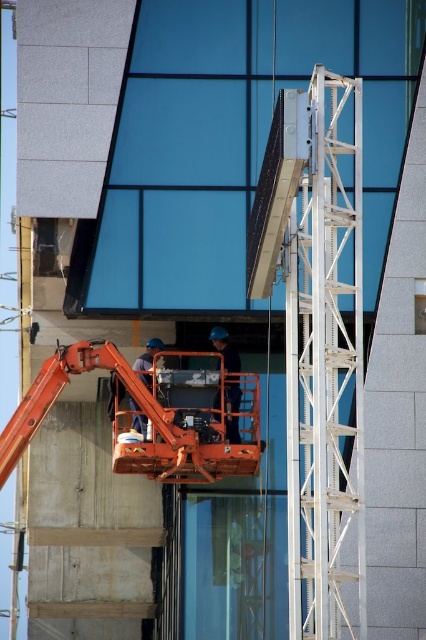
Question: Which point is closer to the camera taking this photo?

Choices:
 (A) (213, 406)
 (B) (359, 116)

Answer: (B)

Question: Among these objects, which one is farthest from the camera?

Choices:
 (A) orange fabric construction worker at center
 (B) white metallic ladder at right

Answer: (A)

Question: Is the position of white metallic ladder at right less distant than that of orange fabric construction worker at center?

Choices:
 (A) no
 (B) yes

Answer: (B)

Question: Does white metallic ladder at right lie in front of orange fabric construction worker at center?

Choices:
 (A) no
 (B) yes

Answer: (B)

Question: Which of the following is the closest to the observer?

Choices:
 (A) (226, 362)
 (B) (342, 368)

Answer: (B)

Question: Can you confirm if white metallic ladder at right is positioned above orange fabric construction worker at center?

Choices:
 (A) no
 (B) yes

Answer: (B)